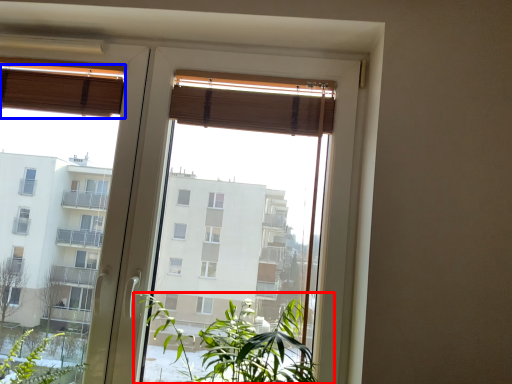
Question: Which point is closer to the camera, houseplant (highlighted by a red box) or curtain (highlighted by a blue box)?

Choices:
 (A) houseplant
 (B) curtain

Answer: (A)